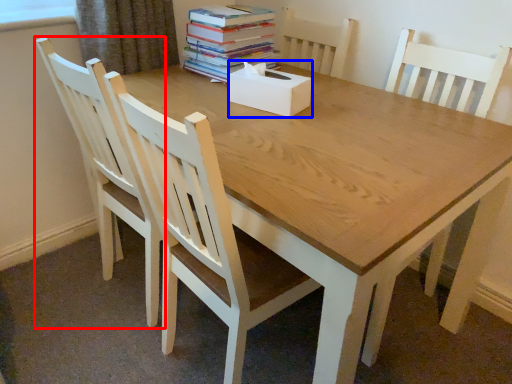
Question: Which object appears farthest to the camera in this image, chair (highlighted by a red box) or box (highlighted by a blue box)?

Choices:
 (A) chair
 (B) box

Answer: (B)